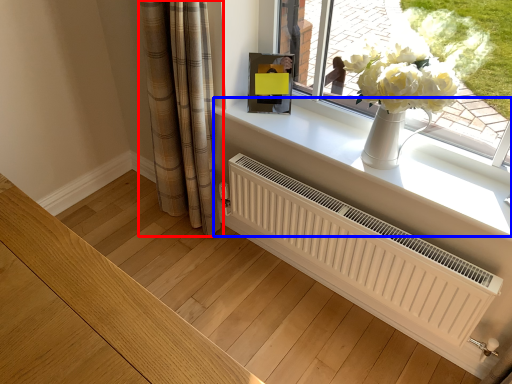
Question: Which object appears closest to the camera in this image, curtain (highlighted by a red box) or window sill (highlighted by a blue box)?

Choices:
 (A) curtain
 (B) window sill

Answer: (B)